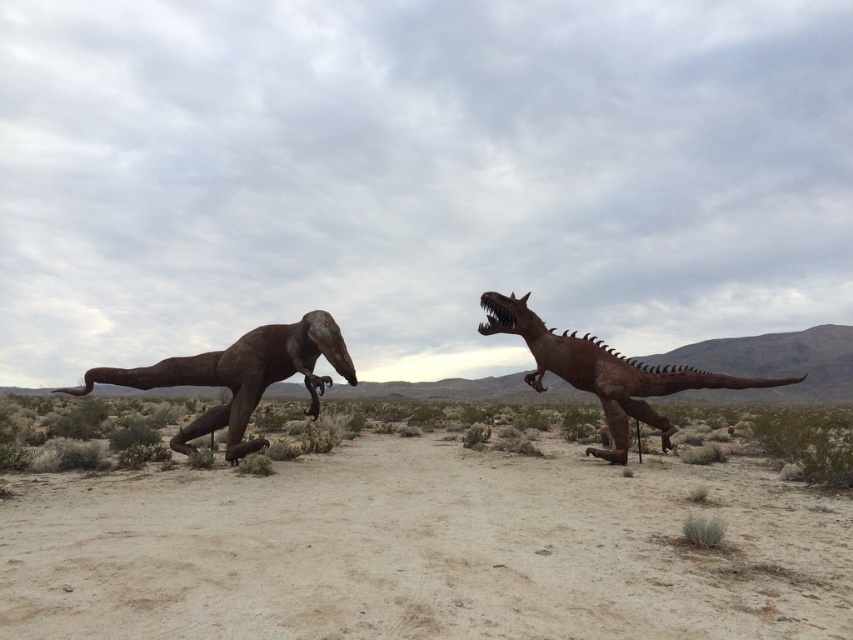
You are a photographer planning to capture the entire scene of the dirt field at center and the rusty metal dinosaur at right in one shot. Based on their sizes, which object should you focus on to ensure both are clearly visible in the frame?

The dirt field at center has a larger size compared to the rusty metal dinosaur at right, so focusing on the dirt field at center will ensure both objects are clearly visible in the frame.

Based on the scene description, where is the dirt field at center located in terms of coordinates?

The dirt field at center is located at coordinates point (424,550).